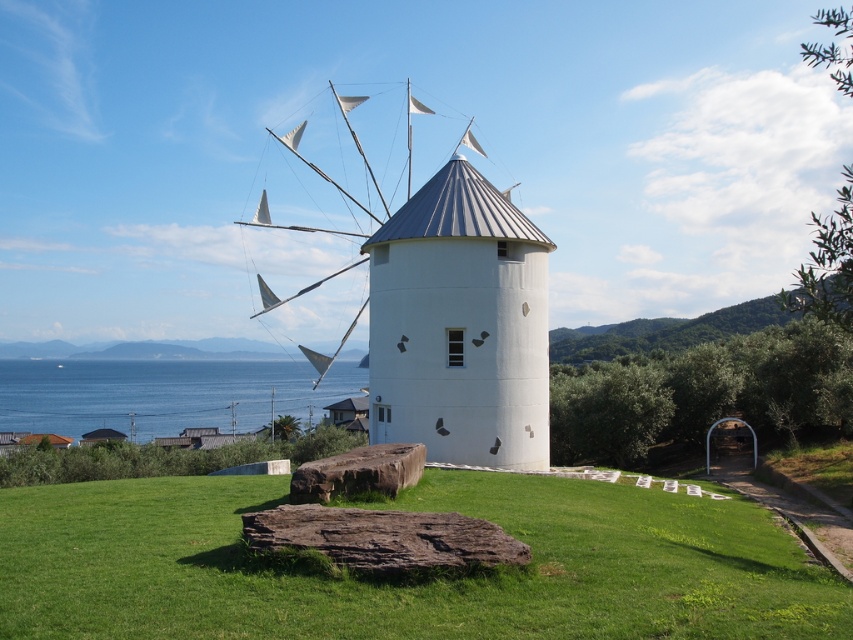
Question: Can you confirm if green grass at center is positioned to the left of blue water at lower left?

Choices:
 (A) yes
 (B) no

Answer: (B)

Question: Does green grass at center have a smaller size compared to blue water at lower left?

Choices:
 (A) yes
 (B) no

Answer: (A)

Question: Is white matte windmill at center to the right of blue water at lower left from the viewer's perspective?

Choices:
 (A) no
 (B) yes

Answer: (B)

Question: Among these points, which one is nearest to the camera?

Choices:
 (A) (370, 365)
 (B) (148, 422)

Answer: (A)

Question: Which object is the farthest from the blue water at lower left?

Choices:
 (A) green grass at center
 (B) white matte windmill at center

Answer: (A)

Question: Which point is farther to the camera?

Choices:
 (A) white matte windmill at center
 (B) blue water at lower left

Answer: (B)